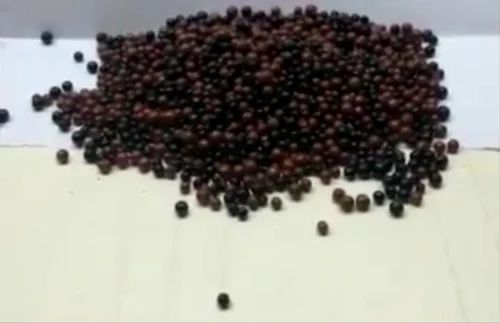
Image resolution: width=500 pixels, height=323 pixels. Find the location of `back grey area of table`. back grey area of table is located at coordinates (66, 12).